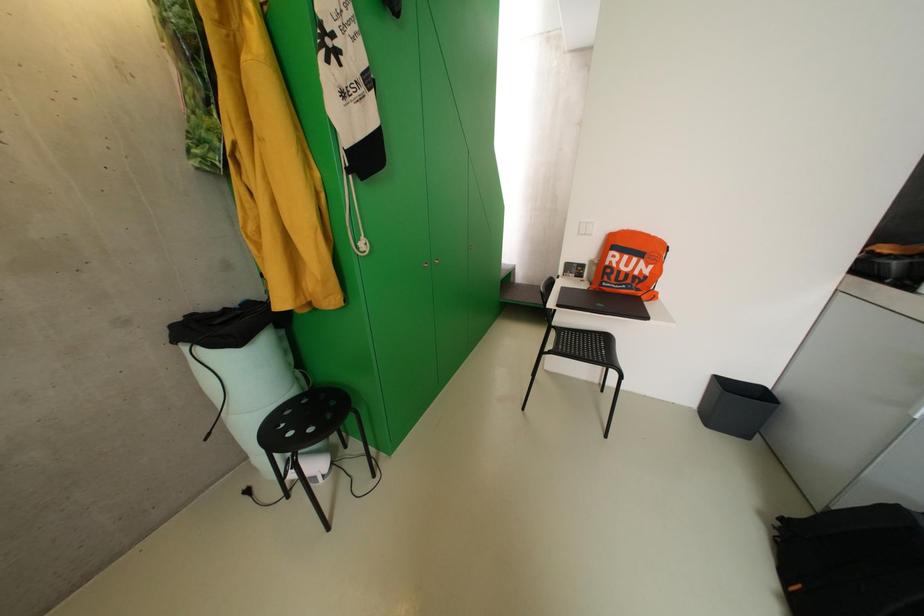
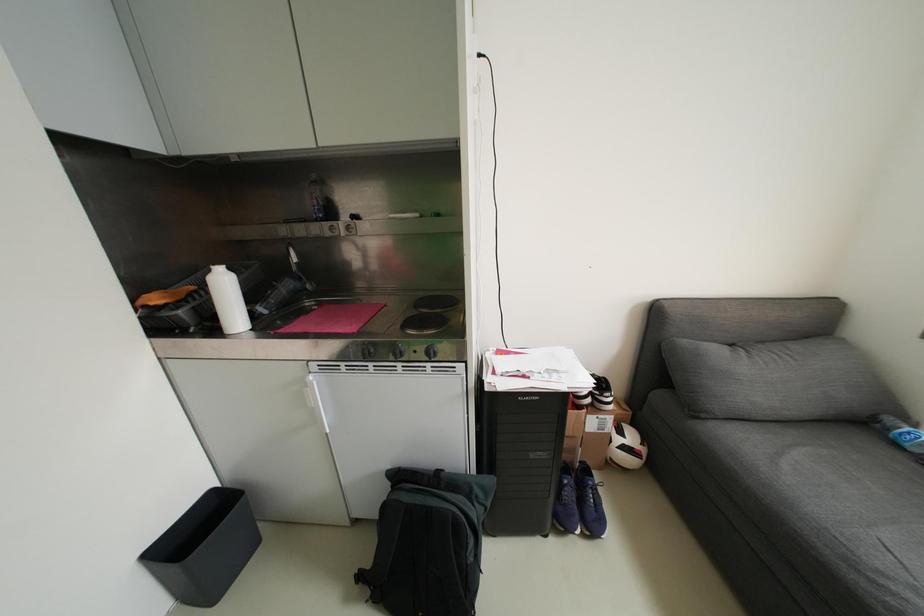
How did the camera likely rotate?

The camera's rotation is toward right-down.